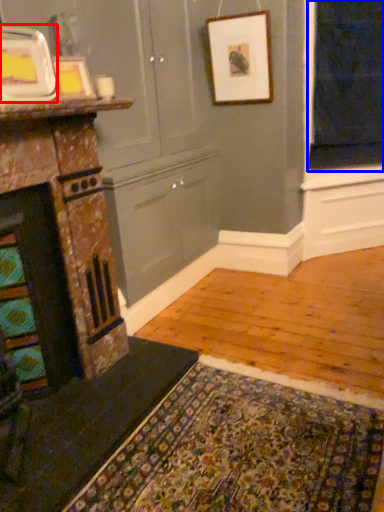
Question: Among these objects, which one is farthest to the camera, picture frame (highlighted by a red box) or window screen (highlighted by a blue box)?

Choices:
 (A) picture frame
 (B) window screen

Answer: (B)